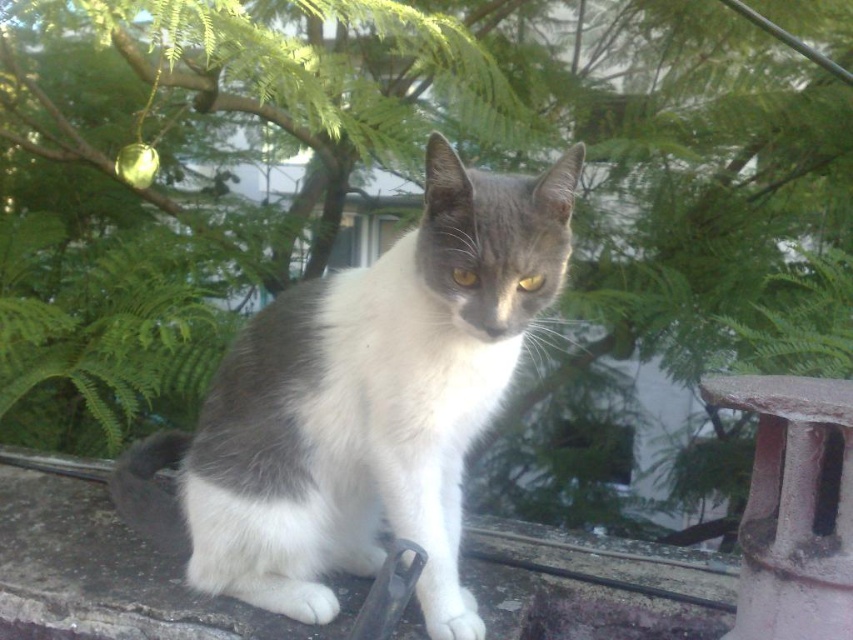
Question: Which of the following is the closest to the observer?

Choices:
 (A) gray concrete window sill at center
 (B) white-furred cat at center

Answer: (B)

Question: Does white-furred cat at center appear under gray concrete window sill at center?

Choices:
 (A) no
 (B) yes

Answer: (A)

Question: Which of the following is the farthest from the observer?

Choices:
 (A) gray concrete window sill at center
 (B) white-furred cat at center

Answer: (A)

Question: Which point is closer to the camera?

Choices:
 (A) white-furred cat at center
 (B) gray concrete window sill at center

Answer: (A)

Question: Can you confirm if white-furred cat at center is positioned below gray concrete window sill at center?

Choices:
 (A) yes
 (B) no

Answer: (B)

Question: Is white-furred cat at center bigger than gray concrete window sill at center?

Choices:
 (A) no
 (B) yes

Answer: (B)